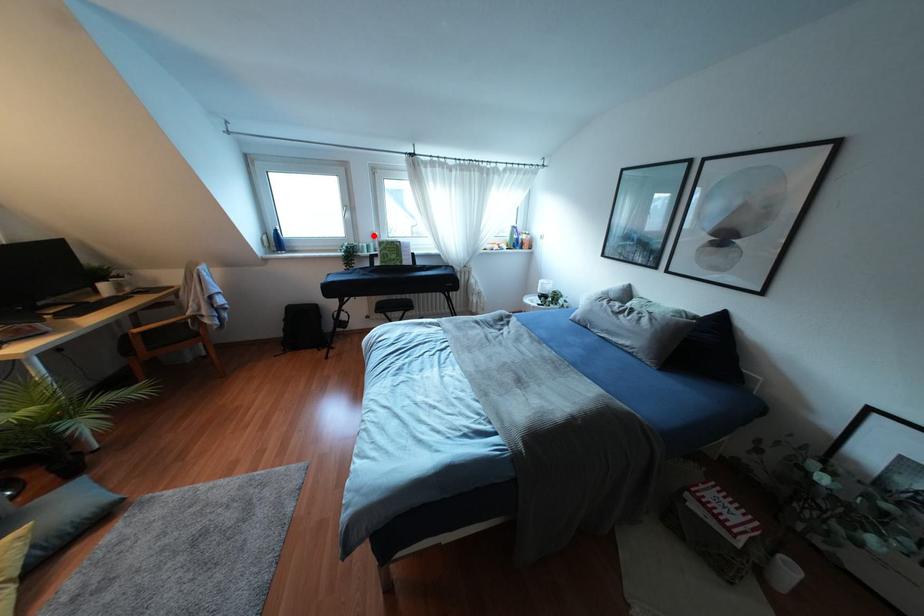
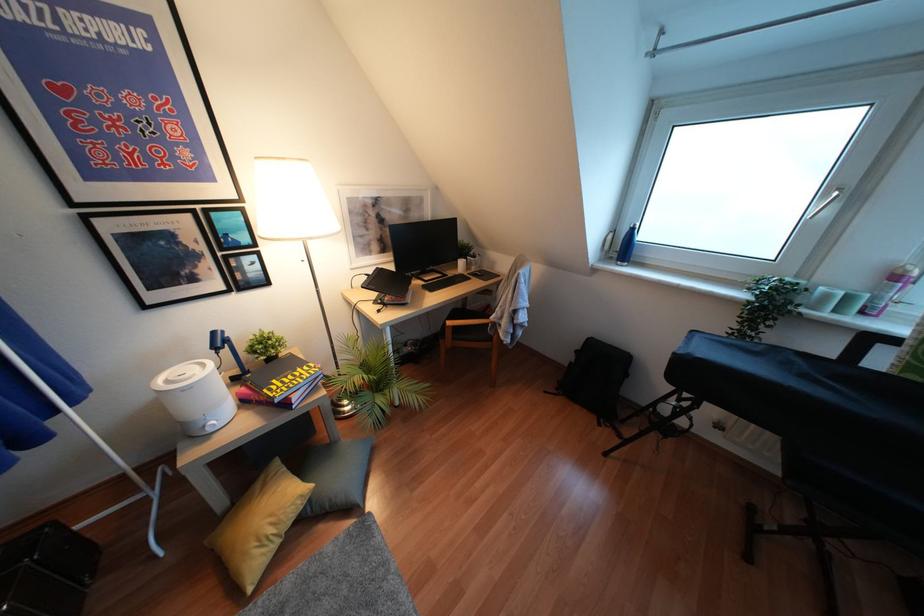
Question: I am providing you with two images of the same scene from different viewpoints. Given a red point in image1, look at the same physical point in image2. Is it:

Choices:
 (A) Closer to the viewpoint
 (B) Farther from the viewpoint

Answer: (B)